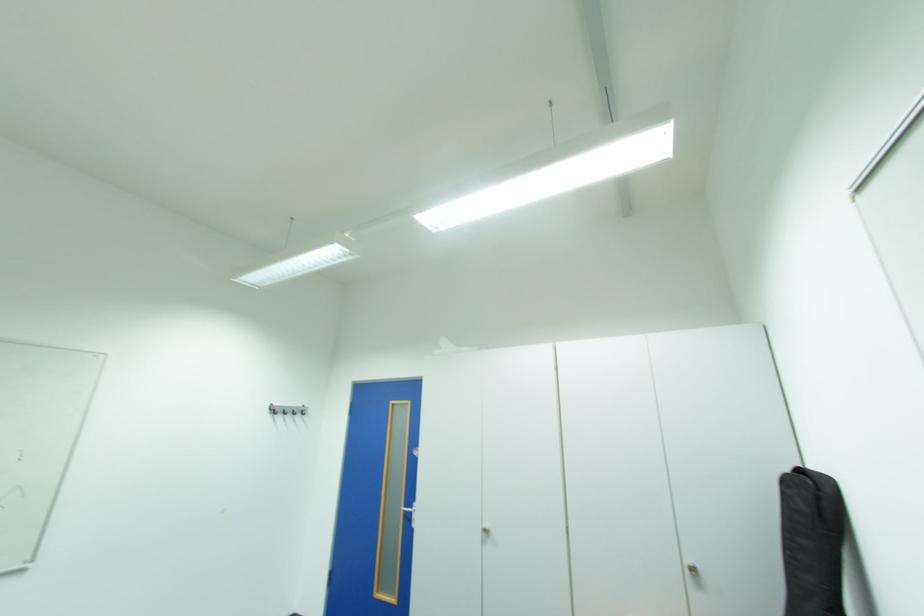
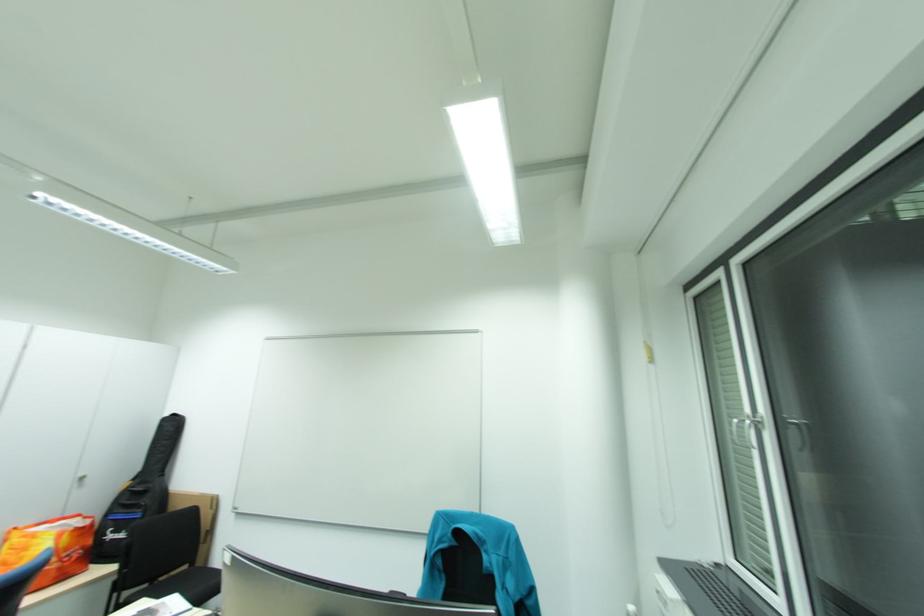
Locate, in the second image, the point that corresponds to (x=697, y=570) in the first image.

(86, 480)